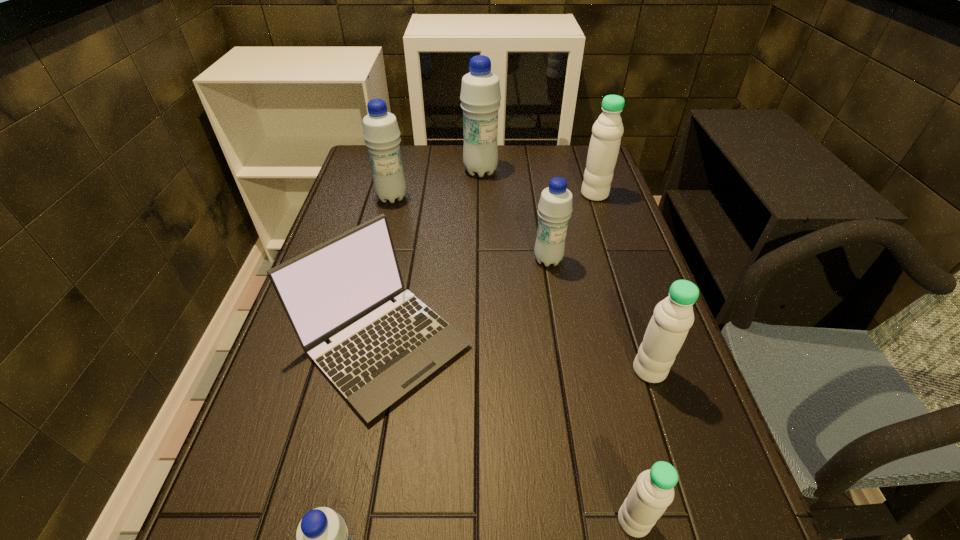
Locate an element on the screen. Image resolution: width=960 pixels, height=540 pixels. the seventh farthest object is located at coordinates (653, 491).

This screenshot has height=540, width=960. In order to click on free space located 0.090m on the back of the farthest water bottle in this screenshot , I will do `click(481, 149)`.

Locate an element on the screen. vacant space located on the front of the biggest white water bottle is located at coordinates (603, 218).

The height and width of the screenshot is (540, 960). I want to click on vacant space located 0.300m on the right of the second biggest blue water bottle, so click(x=507, y=197).

Find the location of a particular element. The width and height of the screenshot is (960, 540). vacant position located on the right of the fourth object from right to left is located at coordinates (645, 260).

Find the location of `free space located 0.090m on the left of the fifth farthest water bottle`. free space located 0.090m on the left of the fifth farthest water bottle is located at coordinates (588, 370).

In order to click on vacant space located at the front screen of the laptop_computer in this screenshot , I will do `click(348, 529)`.

Locate an element on the screen. This screenshot has height=540, width=960. free space located 0.210m on the back of the seventh farthest object is located at coordinates (x=604, y=390).

Locate an element on the screen. Image resolution: width=960 pixels, height=540 pixels. object at the far edge is located at coordinates coord(480,96).

Identify the location of water bottle present at the left edge. The image size is (960, 540). (381, 133).